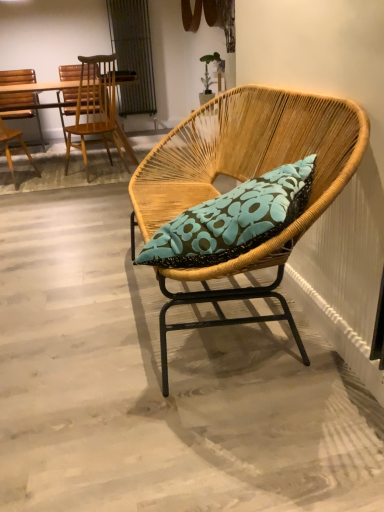
Question: From a real-world perspective, is woven wood chair at center, which ranks as the third chair in left-to-right order, beneath wooden chair at left, arranged as the first chair when viewed from the left?

Choices:
 (A) no
 (B) yes

Answer: (B)

Question: Would you say woven wood chair at center, the 1th chair viewed from the right, is outside wooden chair at left, which appears as the third chair when viewed from the right?

Choices:
 (A) yes
 (B) no

Answer: (A)

Question: Could wooden chair at left, the 3th chair viewed from the front, be considered to be inside woven wood chair at center, the 3th chair in the back-to-front sequence?

Choices:
 (A) no
 (B) yes

Answer: (A)

Question: Does woven wood chair at center, which ranks as the third chair in left-to-right order, have a greater height compared to wooden chair at left, the 3th chair viewed from the front?

Choices:
 (A) no
 (B) yes

Answer: (A)

Question: Does woven wood chair at center, the 3th chair in the back-to-front sequence, lie in front of wooden chair at left, acting as the 1th chair starting from the back?

Choices:
 (A) yes
 (B) no

Answer: (A)

Question: Relative to woven wood chair at center, marked as the 1th chair in a front-to-back arrangement, is wooden chair at left, which appears as the third chair when viewed from the right, in front or behind?

Choices:
 (A) front
 (B) behind

Answer: (B)

Question: In terms of height, does wooden chair at left, arranged as the first chair when viewed from the left, look taller or shorter compared to woven wood chair at center, which ranks as the third chair in left-to-right order?

Choices:
 (A) short
 (B) tall

Answer: (B)

Question: From the image's perspective, is wooden chair at left, acting as the 1th chair starting from the back, located above or below woven wood chair at center, the 1th chair viewed from the right?

Choices:
 (A) below
 (B) above

Answer: (B)

Question: Is wooden chair at left, acting as the 1th chair starting from the back, situated inside woven wood chair at center, the 1th chair viewed from the right, or outside?

Choices:
 (A) inside
 (B) outside

Answer: (B)

Question: Based on their sizes in the image, would you say woven wood chair at center, marked as the 1th chair in a front-to-back arrangement, is bigger or smaller than wooden chair at left, which appears as the third chair when viewed from the right?

Choices:
 (A) big
 (B) small

Answer: (A)

Question: Is woven wood chair at center, the 3th chair in the back-to-front sequence, spatially inside wooden chair at left, arranged as the first chair when viewed from the left, or outside of it?

Choices:
 (A) outside
 (B) inside

Answer: (A)

Question: Considering the positions of point coord(147,228) and point coord(11,101), is point coord(147,228) closer or farther from the camera than point coord(11,101)?

Choices:
 (A) farther
 (B) closer

Answer: (B)

Question: Considering the positions of woven wood chair at center, which ranks as the third chair in left-to-right order, and wooden chair at left, the 3th chair viewed from the front, in the image, is woven wood chair at center, which ranks as the third chair in left-to-right order, taller or shorter than wooden chair at left, the 3th chair viewed from the front,?

Choices:
 (A) tall
 (B) short

Answer: (B)

Question: Considering the positions of woven wood chair at center, which ranks as the third chair in left-to-right order, and brown wooden desk at left in the image, is woven wood chair at center, which ranks as the third chair in left-to-right order, wider or thinner than brown wooden desk at left?

Choices:
 (A) thin
 (B) wide

Answer: (A)

Question: Considering the relative positions of woven wood chair at center, the 3th chair in the back-to-front sequence, and brown wooden desk at left in the image provided, is woven wood chair at center, the 3th chair in the back-to-front sequence, to the left or to the right of brown wooden desk at left?

Choices:
 (A) left
 (B) right

Answer: (B)